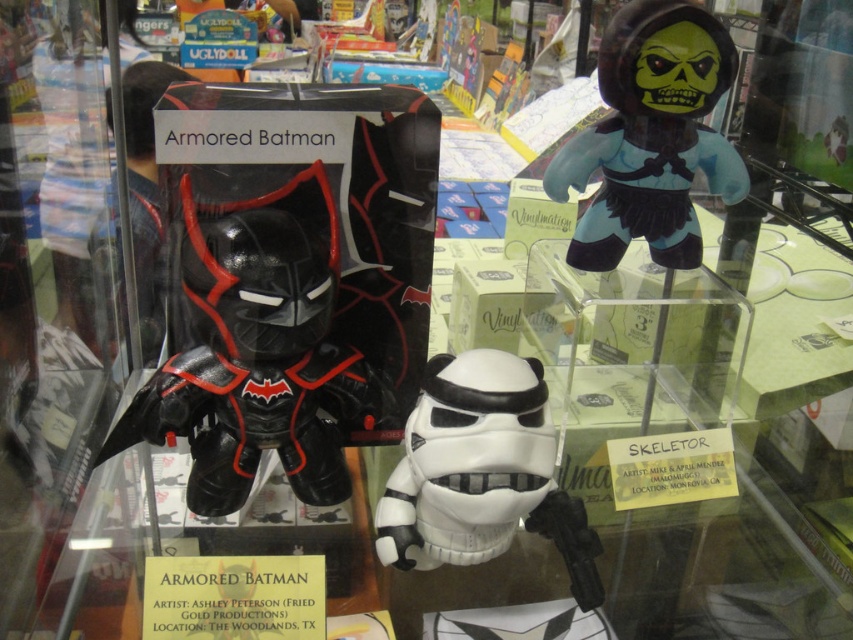
Who is taller, matte black vinyl figure at center or matte black figure at upper right?

matte black vinyl figure at center

Who is higher up, matte black vinyl figure at center or matte black figure at upper right?

matte black figure at upper right

Image resolution: width=853 pixels, height=640 pixels. Identify the location of matte black vinyl figure at center. point(291,284).

Between white matte stormtrooper helmet at center and matte black figure at upper right, which one is positioned lower?

white matte stormtrooper helmet at center

Image resolution: width=853 pixels, height=640 pixels. Describe the element at coordinates (480, 474) in the screenshot. I see `white matte stormtrooper helmet at center` at that location.

Does point (488, 486) come behind point (618, 61)?

No, (488, 486) is in front of (618, 61).

I want to click on white matte stormtrooper helmet at center, so click(x=480, y=474).

Between matte black vinyl figure at center and white matte stormtrooper helmet at center, which one appears on the right side from the viewer's perspective?

white matte stormtrooper helmet at center

Is point (381, 273) behind point (561, 540)?

Yes, point (381, 273) is farther from viewer.

Image resolution: width=853 pixels, height=640 pixels. In order to click on matte black vinyl figure at center in this screenshot , I will do `click(291, 284)`.